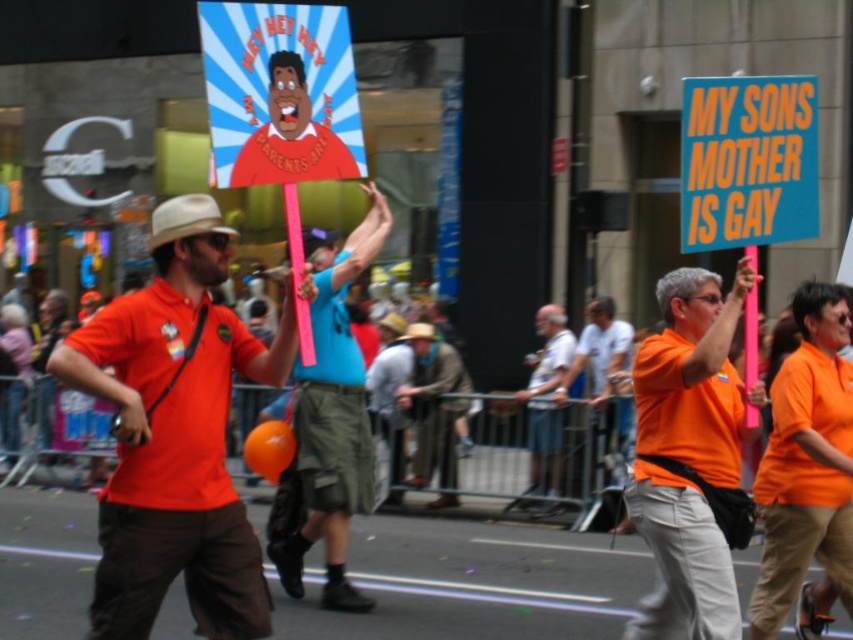
You are a photographer at the parade and want to capture both the orange matte shirt at center and the orange cotton shirt at center in a single photo. Which shirt should you focus on to ensure the other is visible in the background?

The orange matte shirt at center is positioned over orange cotton shirt at center, so focusing on the orange matte shirt at center will allow the orange cotton shirt at center to be visible in the background.

You are a photographer trying to capture the orange cotton shirt at center in your shot. Based on its position, where should you aim your camera?

The orange cotton shirt at center is located at point 0.722 on the x axis and 0.946 on the y axis, so aim your camera towards the lower right area of the image to capture it.